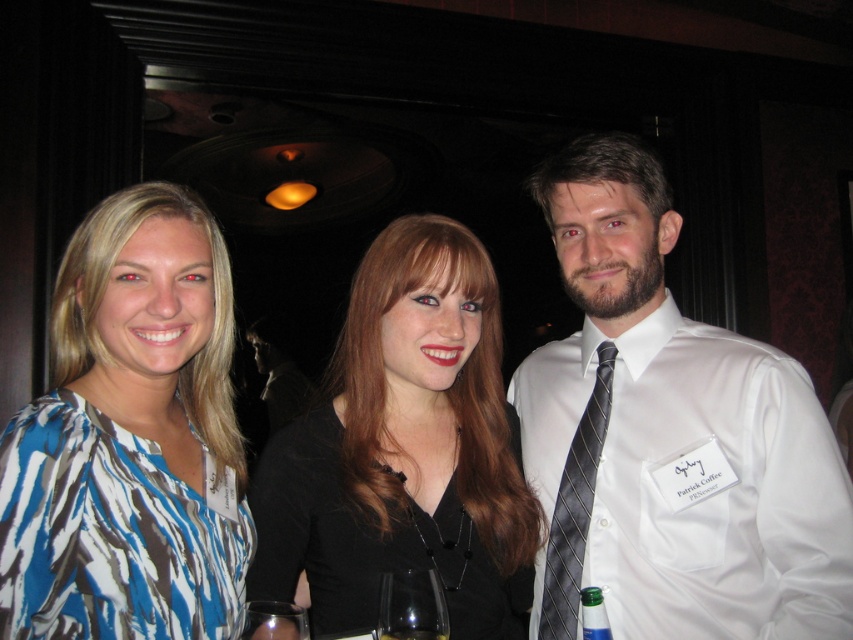
Question: Does black matte dress at center appear on the left side of green glass bottle at lower right?

Choices:
 (A) no
 (B) yes

Answer: (B)

Question: Which point is closer to the camera?

Choices:
 (A) (558, 570)
 (B) (291, 620)
 (C) (492, 429)
 (D) (773, 404)

Answer: (B)

Question: Is the position of black matte dress at center more distant than that of clear glass wine glass at center?

Choices:
 (A) no
 (B) yes

Answer: (B)

Question: Is white satin shirt at center thinner than clear glass wine glass at center?

Choices:
 (A) yes
 (B) no

Answer: (B)

Question: Estimate the real-world distances between objects in this image. Which object is closer to the green glass bottle at lower right?

Choices:
 (A) black satin tie at right
 (B) black matte dress at center
 (C) white satin shirt at center

Answer: (A)

Question: Among these points, which one is nearest to the camera?

Choices:
 (A) (436, 612)
 (B) (453, 513)

Answer: (A)